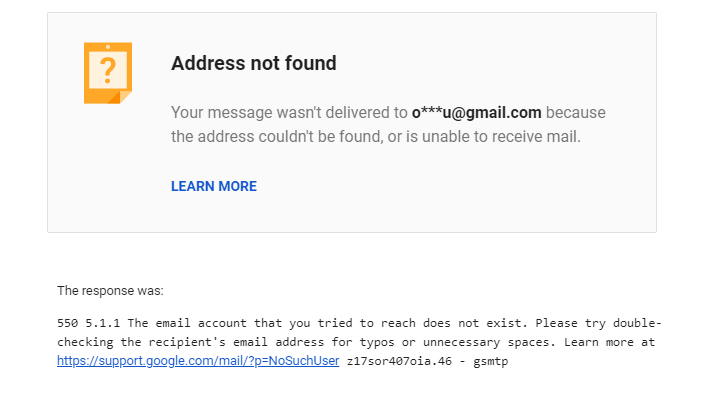
Identify the location of beige colored box. (532, 54).